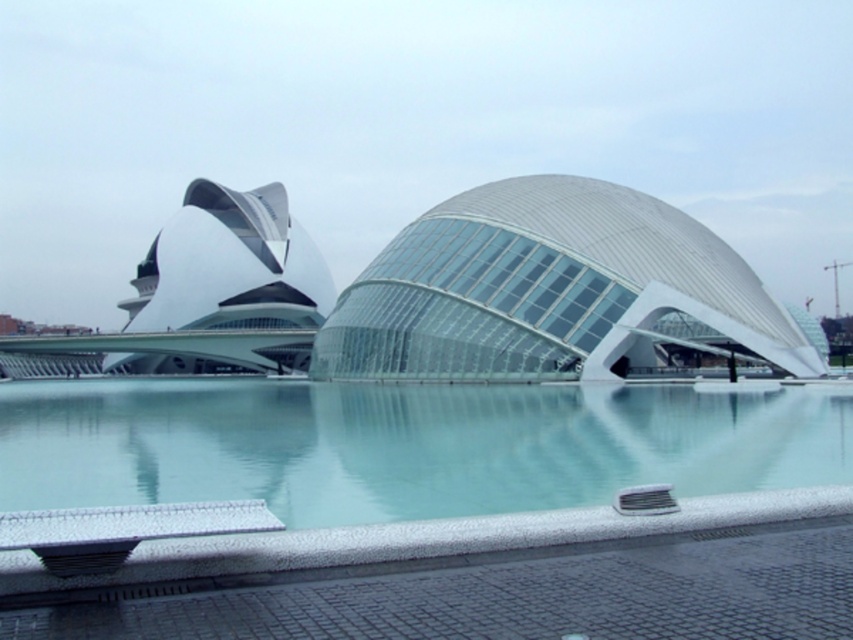
What do you see at coordinates (445, 294) in the screenshot? This screenshot has width=853, height=640. I see `transparent glass dome at center` at bounding box center [445, 294].

Does transparent glass dome at center appear under white speckled tile swimming pool at lower center?

Actually, transparent glass dome at center is above white speckled tile swimming pool at lower center.

Between point (635, 193) and point (61, 436), which one is positioned behind?

Point (635, 193)

Image resolution: width=853 pixels, height=640 pixels. What are the coordinates of `transparent glass dome at center` in the screenshot? It's located at (445, 294).